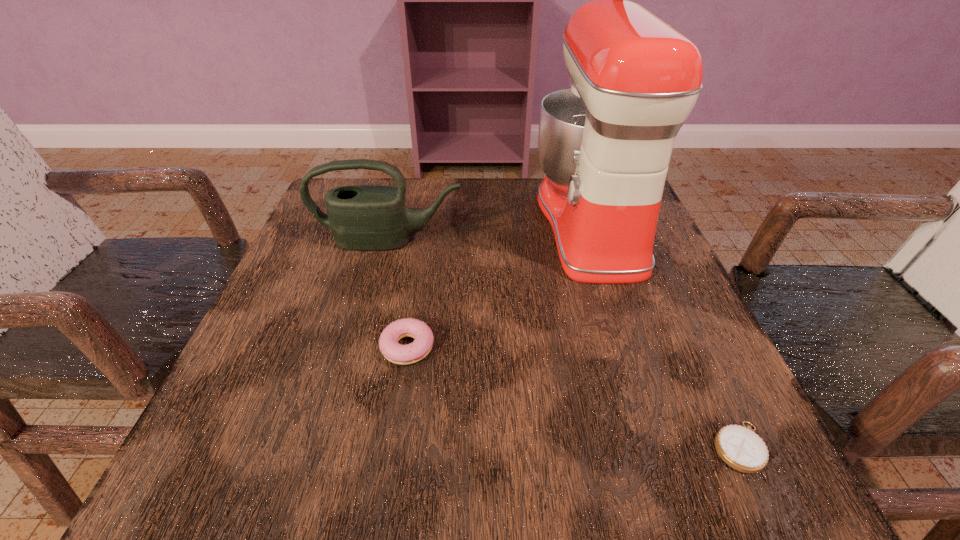
I want to click on free point between the watering can and the tallest object, so click(x=490, y=232).

Identify the location of free space between the second tallest object and the mixer. (490, 232).

Find the location of a particular element. Image resolution: width=960 pixels, height=540 pixels. vacant space in between the third tallest object and the watering can is located at coordinates [398, 294].

Identify the location of free space that is in between the tallest object and the third farthest object. The width and height of the screenshot is (960, 540). (499, 285).

Locate an element on the screen. Image resolution: width=960 pixels, height=540 pixels. vacant space that is in between the mixer and the watering can is located at coordinates (490, 232).

Image resolution: width=960 pixels, height=540 pixels. I want to click on empty location between the nearest object and the mixer, so click(665, 335).

This screenshot has width=960, height=540. I want to click on vacant space in between the doughnut and the tallest object, so click(x=499, y=285).

Locate an element on the screen. The height and width of the screenshot is (540, 960). object that is the nearest to the third shortest object is located at coordinates (605, 143).

Where is `object that is the third closest one to the shortest object`? This screenshot has width=960, height=540. object that is the third closest one to the shortest object is located at coordinates click(362, 217).

Where is `free region that satisfies the following two spatial constraints: 1. on the spout of the compass; 2. on the right side of the third shortest object`? Image resolution: width=960 pixels, height=540 pixels. free region that satisfies the following two spatial constraints: 1. on the spout of the compass; 2. on the right side of the third shortest object is located at coordinates (335, 447).